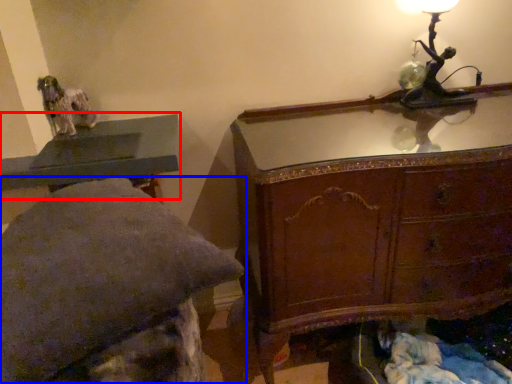
Question: Which object appears closest to the camera in this image, table (highlighted by a red box) or furniture (highlighted by a blue box)?

Choices:
 (A) table
 (B) furniture

Answer: (B)